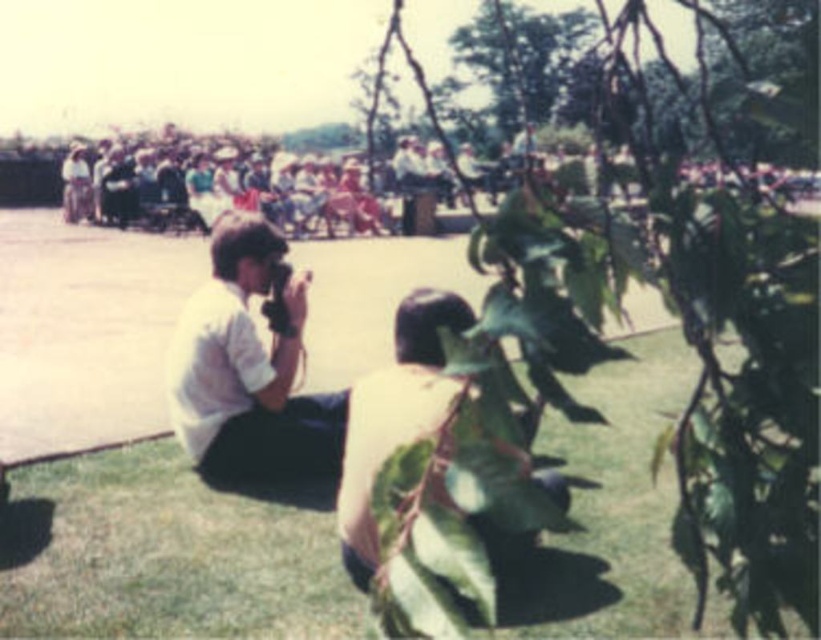
Question: Is green leafy tree at center to the left of green grass at lower center from the viewer's perspective?

Choices:
 (A) yes
 (B) no

Answer: (B)

Question: Which point appears closest to the camera in this image?

Choices:
 (A) (269, 454)
 (B) (659, 262)

Answer: (B)

Question: Does green grass at lower center appear on the right side of white matte camera at center?

Choices:
 (A) no
 (B) yes

Answer: (A)

Question: Which point appears closest to the camera in this image?

Choices:
 (A) (645, 497)
 (B) (797, 221)
 (C) (328, 406)

Answer: (B)

Question: Which of the following is the closest to the observer?

Choices:
 (A) (274, 545)
 (B) (537, 193)

Answer: (B)

Question: Is green grass at lower center above white matte camera at center?

Choices:
 (A) yes
 (B) no

Answer: (B)